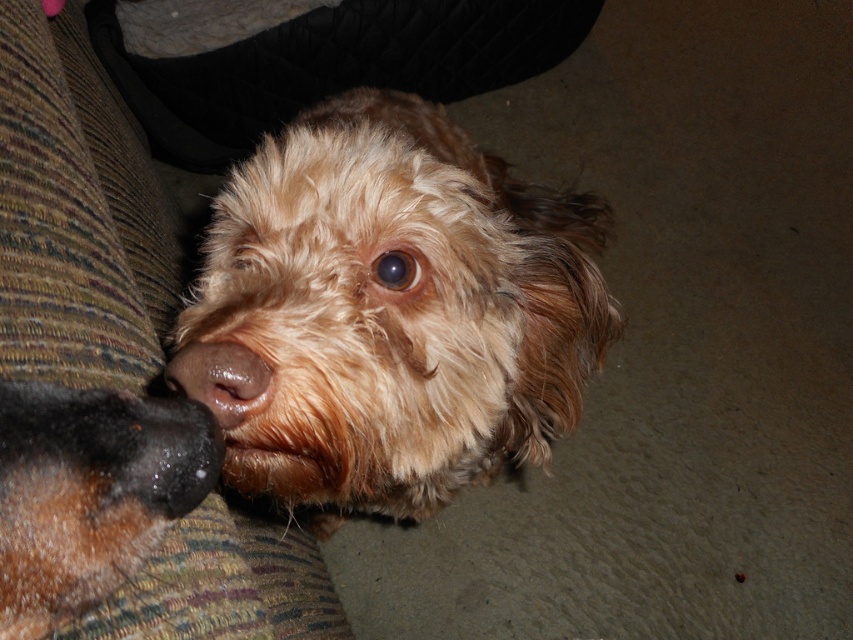
Is brown fuzzy nose at left below brown matte nose at center?

Yes, brown fuzzy nose at left is below brown matte nose at center.

Which is more to the left, brown fuzzy nose at left or brown matte nose at center?

From the viewer's perspective, brown fuzzy nose at left appears more on the left side.

What do you see at coordinates (90, 493) in the screenshot? I see `brown fuzzy nose at left` at bounding box center [90, 493].

Locate an element on the screen. brown fuzzy nose at left is located at coordinates (90, 493).

Between fuzzy brown dog at center and brown matte nose at center, which one appears on the left side from the viewer's perspective?

Positioned to the left is brown matte nose at center.

Which is behind, point (544, 422) or point (212, 356)?

The point (544, 422) is more distant.

Does point (389, 292) lie behind point (202, 356)?

Yes, it is behind point (202, 356).

At what (x,y) coordinates should I click in order to perform the action: click on fuzzy brown dog at center. Please return your answer as a coordinate pair (x, y). This screenshot has height=640, width=853. Looking at the image, I should click on (397, 307).

Which is behind, point (300, 451) or point (39, 547)?

Positioned behind is point (300, 451).

Who is more forward, (x=347, y=376) or (x=61, y=468)?

Point (x=61, y=468) is more forward.

At what (x,y) coordinates should I click in order to perform the action: click on fuzzy brown dog at center. Please return your answer as a coordinate pair (x, y). The height and width of the screenshot is (640, 853). Looking at the image, I should click on (397, 307).